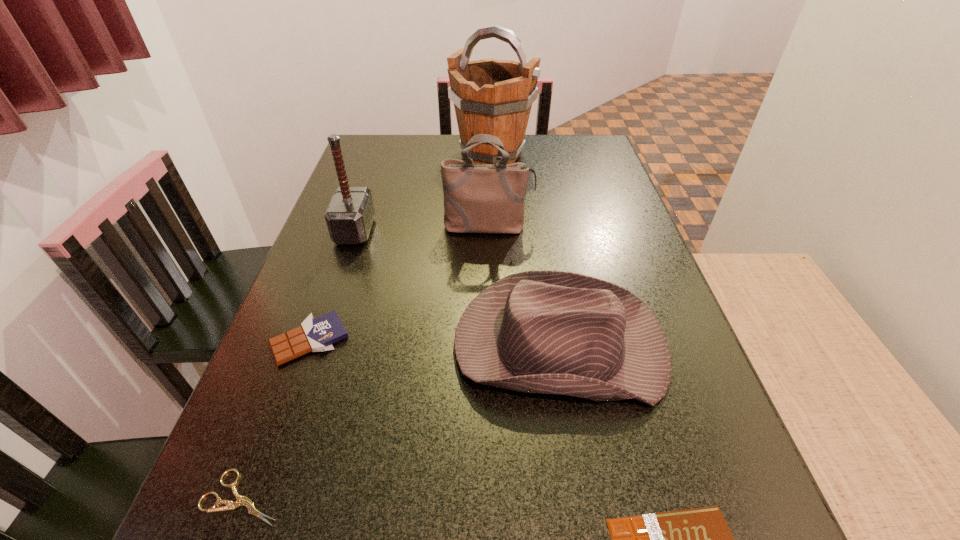
Where is `free space that satisfies the following two spatial constraints: 1. on the front side of the fedora; 2. on the right side of the left chocolate bar`? Image resolution: width=960 pixels, height=540 pixels. free space that satisfies the following two spatial constraints: 1. on the front side of the fedora; 2. on the right side of the left chocolate bar is located at coordinates (308, 344).